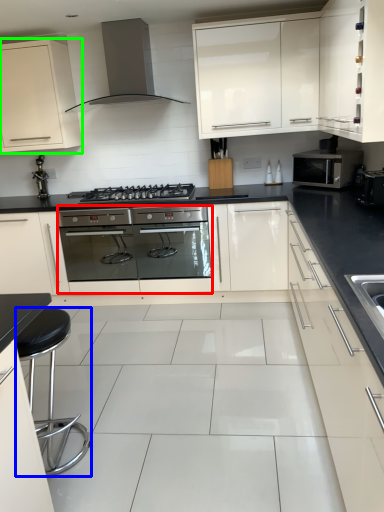
Question: Based on their relative distances, which object is nearer to oven (highlighted by a red box)? Choose from bar stool (highlighted by a blue box) and cabinetry (highlighted by a green box).

Choices:
 (A) bar stool
 (B) cabinetry

Answer: (B)